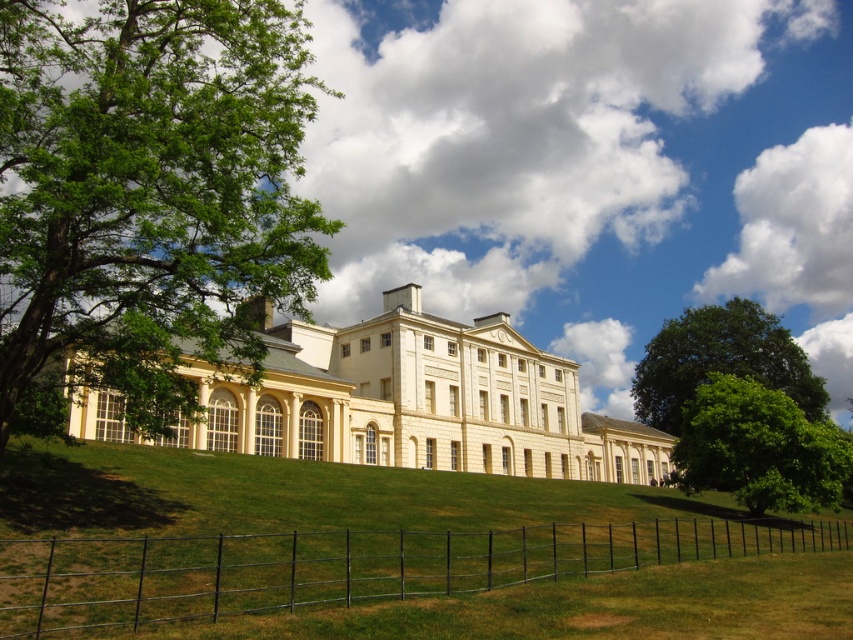
You are standing in front of the classical building and want to take a photo of the entire structure. The black wire fence at lower center is in your way. Can you move to the left or right to avoid it?

The black wire fence at lower center is positioned at point 0.886 on the x axis and 0.407 on the y axis. Since the fence is centrally located, moving either left or right should allow you to avoid it and capture the entire building in your photo.

You are standing in a park and see the black wire fence at lower center and the green leafy tree at lower right. Which object is closer to you?

The black wire fence at lower center is closer to you because it is smaller than the green leafy tree at lower right.